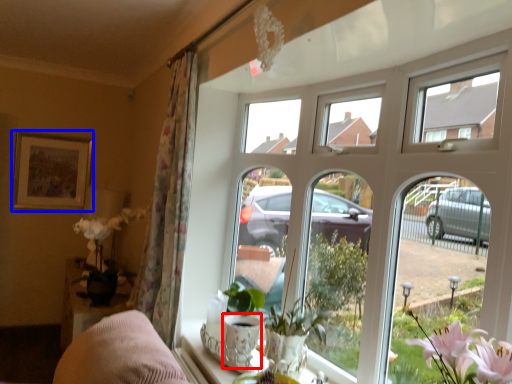
Question: Which object appears farthest to the camera in this image, glass vase (highlighted by a red box) or picture frame (highlighted by a blue box)?

Choices:
 (A) glass vase
 (B) picture frame

Answer: (B)